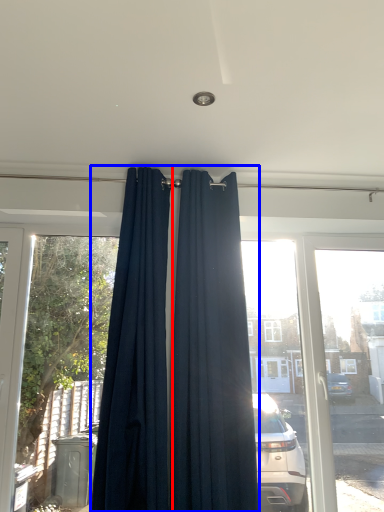
Question: Which point is further to the camera, curtain (highlighted by a red box) or curtain (highlighted by a blue box)?

Choices:
 (A) curtain
 (B) curtain

Answer: (B)